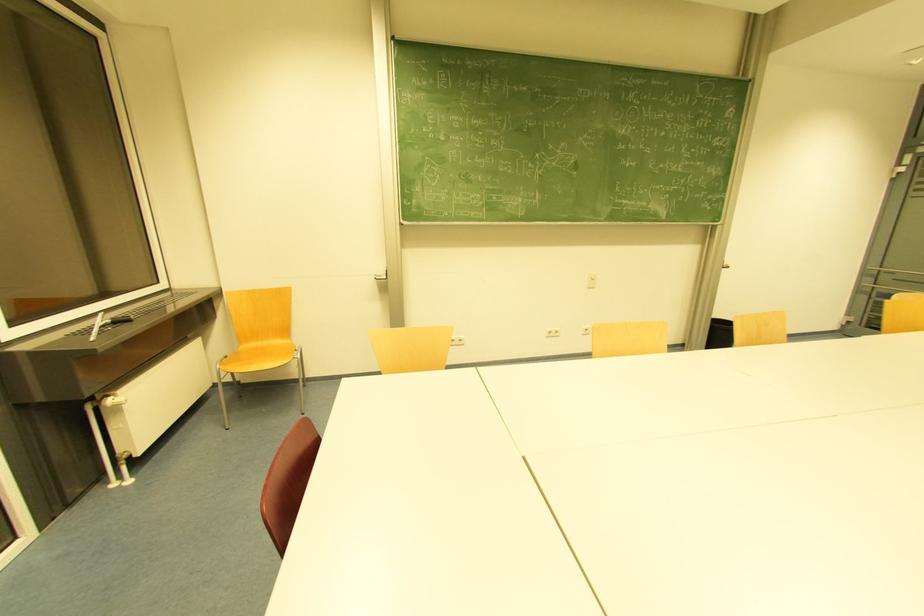
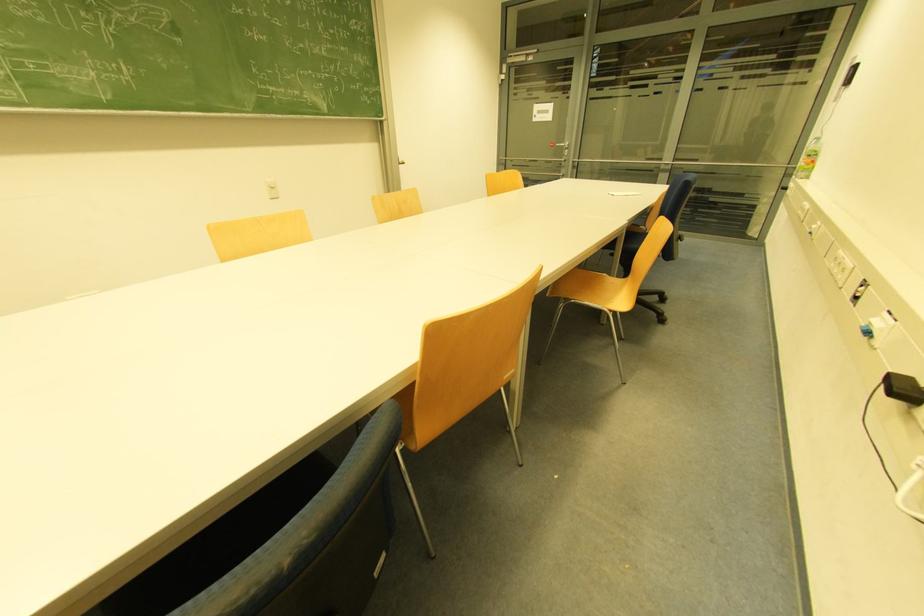
First-person continuous shooting, in which direction is the camera rotating?

The camera's rotation is toward right-down.